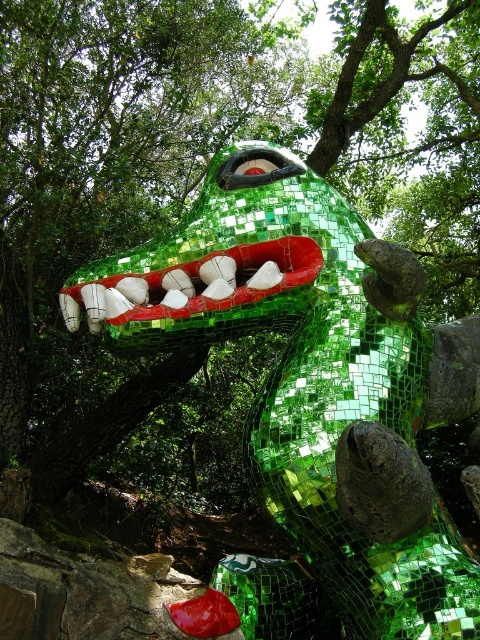
Question: Does green mosaic dragon at center appear over shiny green mosaic mouth at center?

Choices:
 (A) yes
 (B) no

Answer: (B)

Question: Which point is closer to the camera taking this photo?

Choices:
 (A) (464, 627)
 (B) (312, 269)

Answer: (A)

Question: Is green mosaic dragon at center smaller than shiny green mosaic mouth at center?

Choices:
 (A) no
 (B) yes

Answer: (A)

Question: Is the position of green mosaic dragon at center less distant than that of shiny green mosaic mouth at center?

Choices:
 (A) yes
 (B) no

Answer: (A)